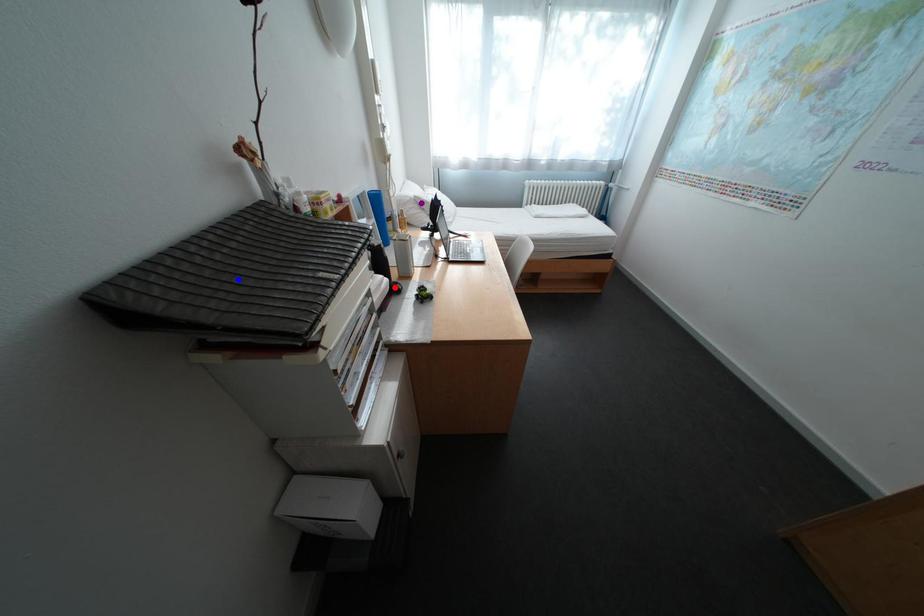
Order these from nearest to farthest:
blue point, purple point, red point

blue point → red point → purple point